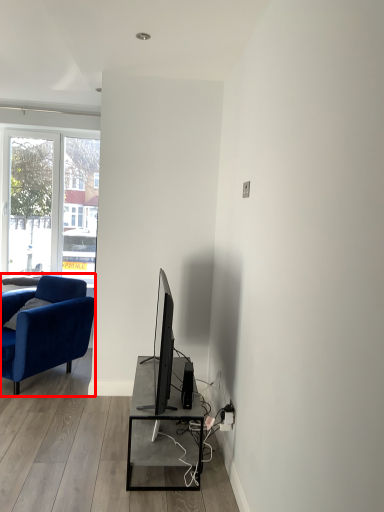
Question: From the image's perspective, considering the relative positions of chair (annotated by the red box) and speaker in the image provided, where is chair (annotated by the red box) located with respect to the staircase?

Choices:
 (A) below
 (B) above

Answer: (B)